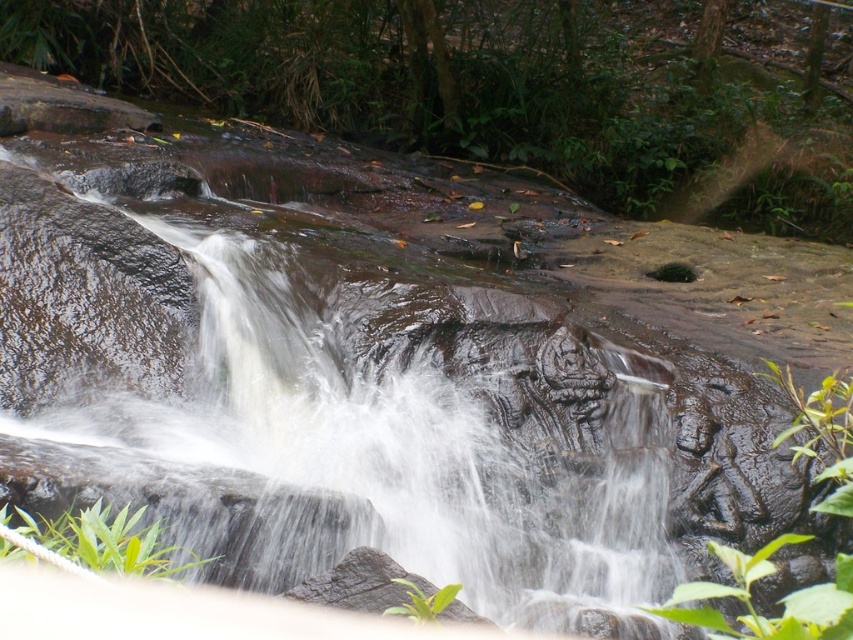
Question: Is green leafy vegetation at center further to the viewer compared to green matte rock at center?

Choices:
 (A) yes
 (B) no

Answer: (A)

Question: Which of the following is the farthest from the observer?

Choices:
 (A) green leafy plant at lower left
 (B) smooth brown rock at center

Answer: (B)

Question: Which point is closer to the camera taking this photo?

Choices:
 (A) (746, 628)
 (B) (61, 536)
 (C) (318, 42)

Answer: (B)

Question: Is green leafy vegetation at center to the right of green leafy plant at lower left from the viewer's perspective?

Choices:
 (A) yes
 (B) no

Answer: (A)

Question: Which of the following is the closest to the observer?

Choices:
 (A) (306, 576)
 (B) (727, 556)
 (C) (785, 195)

Answer: (B)

Question: Can you confirm if green leafy vegetation at center is wider than green leafy plant at lower left?

Choices:
 (A) yes
 (B) no

Answer: (A)